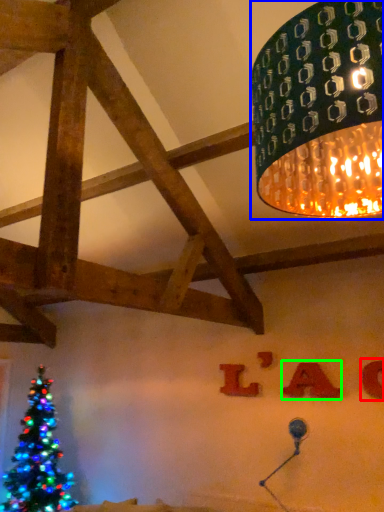
Question: Which object is the farthest from alphabet (highlighted by a red box)? Choose among these: lamp (highlighted by a blue box) or alphabet (highlighted by a green box).

Choices:
 (A) lamp
 (B) alphabet

Answer: (A)